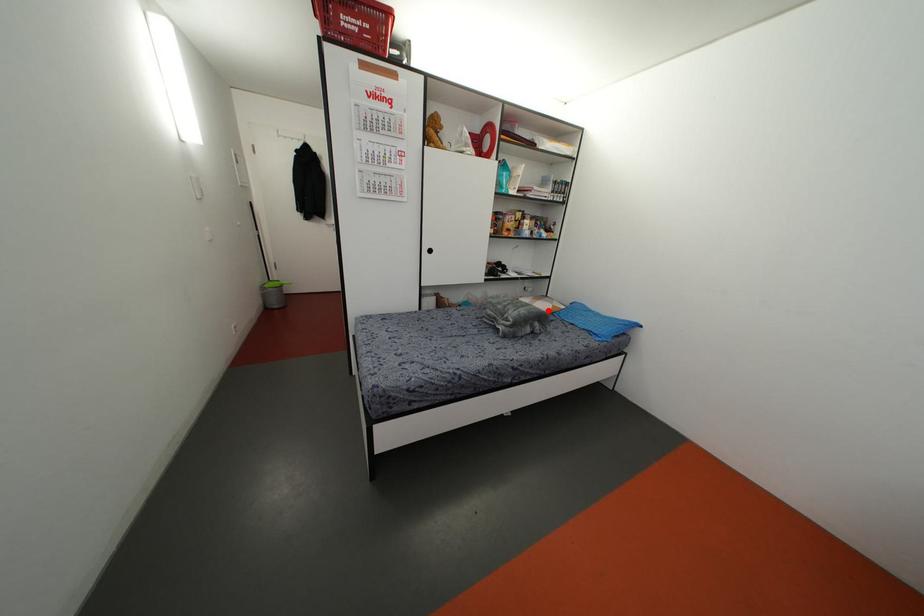
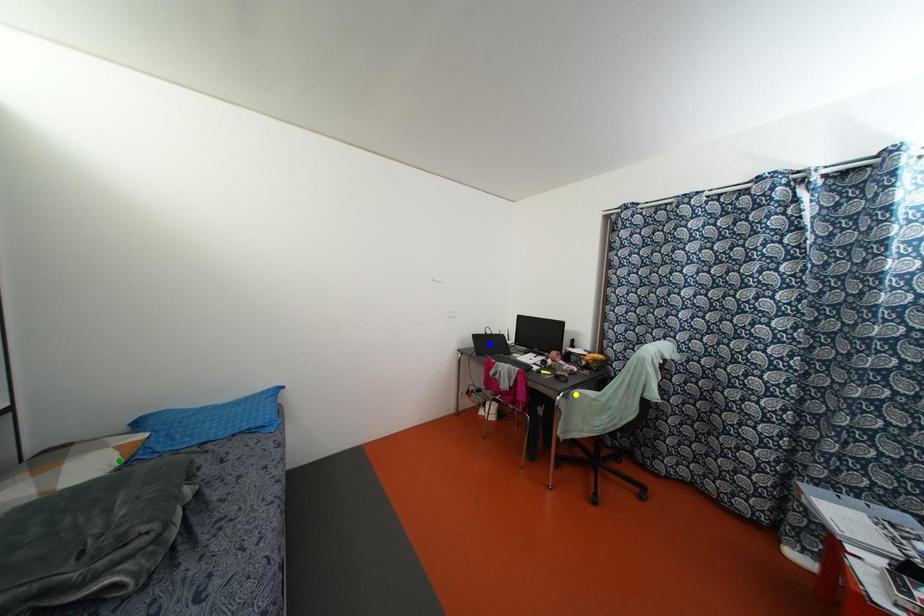
Question: I am providing you with two images of the same scene from different viewpoints. A red point is marked on the first image. You are given multiple points on the second image. In image 2, which mark is for the same physical point as the one in image 1?

Choices:
 (A) green point
 (B) yellow point
 (C) blue point

Answer: (A)